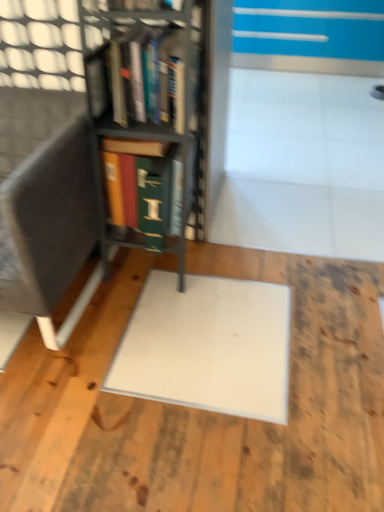
Question: Is white matte wood at center located within hardcover books at center, the second book from the bottom?

Choices:
 (A) yes
 (B) no

Answer: (B)

Question: Does hardcover books at center, the second book from the bottom, have a larger size compared to white matte wood at center?

Choices:
 (A) yes
 (B) no

Answer: (B)

Question: Considering the relative positions of hardcover books at center, the second book from the bottom, and white matte wood at center in the image provided, is hardcover books at center, the second book from the bottom, to the left of white matte wood at center from the viewer's perspective?

Choices:
 (A) no
 (B) yes

Answer: (B)

Question: Is hardcover books at center, which is the first book in top-to-bottom order, wider than white matte wood at center?

Choices:
 (A) no
 (B) yes

Answer: (A)

Question: From a real-world perspective, is hardcover books at center, which is the first book in top-to-bottom order, positioned under white matte wood at center based on gravity?

Choices:
 (A) yes
 (B) no

Answer: (B)

Question: In the image, is green matte book at center, positioned as the first book in bottom-to-top order, on the left side or the right side of white matte wood at center?

Choices:
 (A) left
 (B) right

Answer: (A)

Question: Relative to white matte wood at center, is green matte book at center, the second book viewed from the top, in front or behind?

Choices:
 (A) behind
 (B) front

Answer: (A)

Question: Does point (173, 222) appear closer or farther from the camera than point (44, 495)?

Choices:
 (A) closer
 (B) farther

Answer: (B)

Question: Is green matte book at center, the second book viewed from the top, bigger or smaller than white matte wood at center?

Choices:
 (A) small
 (B) big

Answer: (A)

Question: Choose the correct answer: Is metallic gray bookcase at center inside hardcover books at center, which is the first book in top-to-bottom order, or outside it?

Choices:
 (A) outside
 (B) inside

Answer: (A)

Question: Considering their positions, is metallic gray bookcase at center located in front of or behind hardcover books at center, the second book from the bottom?

Choices:
 (A) behind
 (B) front

Answer: (B)

Question: Looking at the image, does metallic gray bookcase at center seem bigger or smaller compared to hardcover books at center, the second book from the bottom?

Choices:
 (A) small
 (B) big

Answer: (B)

Question: In terms of width, does metallic gray bookcase at center look wider or thinner when compared to hardcover books at center, which is the first book in top-to-bottom order?

Choices:
 (A) wide
 (B) thin

Answer: (A)

Question: Considering the positions of white matte wood at center and hardcover books at center, which is the first book in top-to-bottom order, in the image, is white matte wood at center taller or shorter than hardcover books at center, which is the first book in top-to-bottom order,?

Choices:
 (A) short
 (B) tall

Answer: (A)

Question: From a real-world perspective, relative to hardcover books at center, the second book from the bottom, is white matte wood at center vertically above or below?

Choices:
 (A) below
 (B) above

Answer: (A)